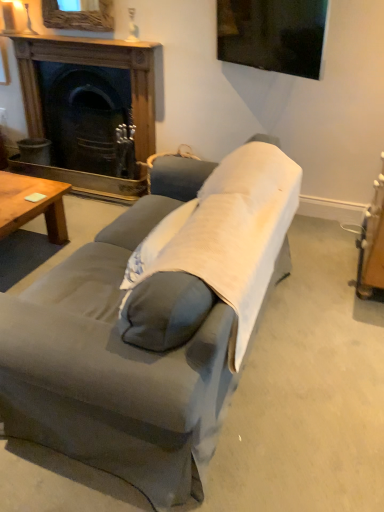
Question: From a real-world perspective, is light gray fabric pillow at center positioned under wooden coffee table at lower left based on gravity?

Choices:
 (A) yes
 (B) no

Answer: (B)

Question: From the image's perspective, is light gray fabric pillow at center under wooden coffee table at lower left?

Choices:
 (A) no
 (B) yes

Answer: (B)

Question: Is light gray fabric pillow at center facing towards wooden coffee table at lower left?

Choices:
 (A) yes
 (B) no

Answer: (A)

Question: Is light gray fabric pillow at center to the left of wooden coffee table at lower left from the viewer's perspective?

Choices:
 (A) no
 (B) yes

Answer: (A)

Question: From a real-world perspective, is light gray fabric pillow at center on wooden coffee table at lower left?

Choices:
 (A) yes
 (B) no

Answer: (A)

Question: Is point (167, 236) positioned closer to the camera than point (109, 51)?

Choices:
 (A) closer
 (B) farther

Answer: (A)

Question: Which is correct: light gray fabric pillow at center is inside wooden fireplace at upper left, or outside of it?

Choices:
 (A) outside
 (B) inside

Answer: (A)

Question: From the image's perspective, is light gray fabric pillow at center positioned above or below wooden fireplace at upper left?

Choices:
 (A) below
 (B) above

Answer: (A)

Question: In the image, is light gray fabric pillow at center positioned in front of or behind wooden fireplace at upper left?

Choices:
 (A) behind
 (B) front

Answer: (B)

Question: Would you say light gray fabric pillow at center is inside or outside gray fabric couch at center?

Choices:
 (A) outside
 (B) inside

Answer: (A)

Question: Is light gray fabric pillow at center taller or shorter than gray fabric couch at center?

Choices:
 (A) short
 (B) tall

Answer: (B)

Question: Considering the positions of light gray fabric pillow at center and gray fabric couch at center in the image, is light gray fabric pillow at center wider or thinner than gray fabric couch at center?

Choices:
 (A) thin
 (B) wide

Answer: (A)

Question: Based on their positions, is light gray fabric pillow at center located to the left or right of gray fabric couch at center?

Choices:
 (A) left
 (B) right

Answer: (B)

Question: From the image's perspective, is wooden coffee table at lower left located above or below light gray fabric pillow at center?

Choices:
 (A) below
 (B) above

Answer: (B)

Question: From a real-world perspective, is wooden coffee table at lower left above or below light gray fabric pillow at center?

Choices:
 (A) below
 (B) above

Answer: (A)